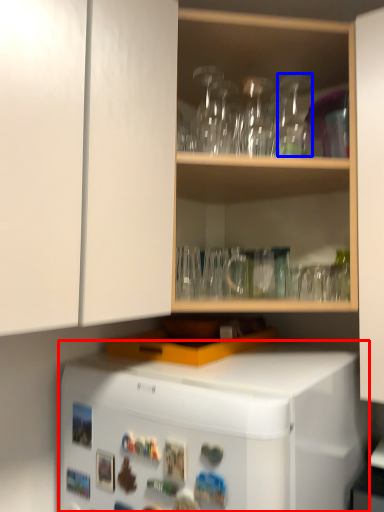
Question: Which of the following is the closest to the observer, refrigerator (highlighted by a red box) or glass vase (highlighted by a blue box)?

Choices:
 (A) refrigerator
 (B) glass vase

Answer: (A)